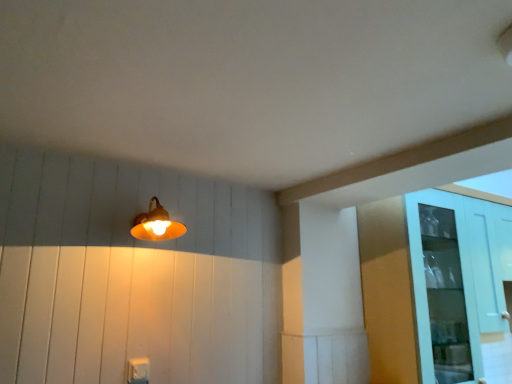
Question: Would you say light blue glass cabinet at right is to the left or to the right of matte orange lampshade at upper left in the picture?

Choices:
 (A) left
 (B) right

Answer: (B)

Question: Is light blue glass cabinet at right taller or shorter than matte orange lampshade at upper left?

Choices:
 (A) tall
 (B) short

Answer: (A)

Question: Looking at their shapes, would you say light blue glass cabinet at right is wider or thinner than matte orange lampshade at upper left?

Choices:
 (A) wide
 (B) thin

Answer: (A)

Question: Is point (169, 233) closer or farther from the camera than point (428, 332)?

Choices:
 (A) farther
 (B) closer

Answer: (B)

Question: From a real-world perspective, relative to light blue glass cabinet at right, is matte orange lampshade at upper left vertically above or below?

Choices:
 (A) above
 (B) below

Answer: (A)

Question: Relative to light blue glass cabinet at right, is matte orange lampshade at upper left in front or behind?

Choices:
 (A) front
 (B) behind

Answer: (A)

Question: From the image's perspective, relative to light blue glass cabinet at right, is matte orange lampshade at upper left above or below?

Choices:
 (A) below
 (B) above

Answer: (B)